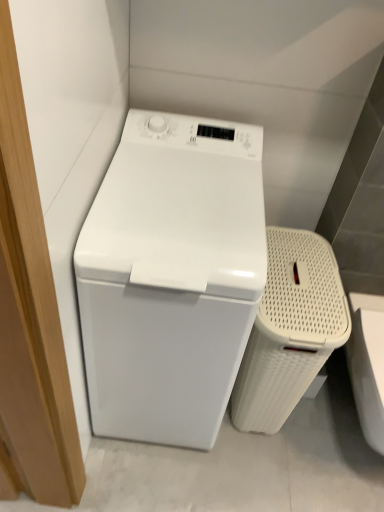
Question: From a real-world perspective, is white glossy washing machine at left physically located above or below white woven laundry basket at right?

Choices:
 (A) above
 (B) below

Answer: (A)

Question: Is white glossy washing machine at left taller or shorter than white woven laundry basket at right?

Choices:
 (A) short
 (B) tall

Answer: (B)

Question: Based on their positions, is white glossy washing machine at left located to the left or right of white woven laundry basket at right?

Choices:
 (A) right
 (B) left

Answer: (B)

Question: Considering the positions of white woven laundry basket at right and white glossy washing machine at left in the image, is white woven laundry basket at right wider or thinner than white glossy washing machine at left?

Choices:
 (A) thin
 (B) wide

Answer: (A)

Question: Considering the relative positions of white woven laundry basket at right and white glossy washing machine at left in the image provided, is white woven laundry basket at right to the left or to the right of white glossy washing machine at left?

Choices:
 (A) right
 (B) left

Answer: (A)

Question: From a real-world perspective, is white woven laundry basket at right physically located above or below white glossy washing machine at left?

Choices:
 (A) below
 (B) above

Answer: (A)

Question: Relative to white glossy washing machine at left, is white woven laundry basket at right in front or behind?

Choices:
 (A) front
 (B) behind

Answer: (B)